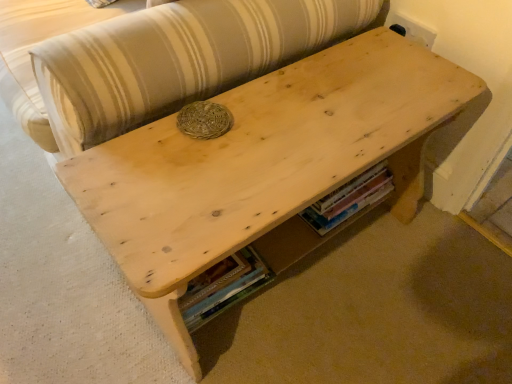
Question: Is wooden book at lower center, which is counted as the first book, starting from the right, inside the boundaries of wooden book at lower center, which appears as the 1th book when ordered from the bottom, or outside?

Choices:
 (A) outside
 (B) inside

Answer: (A)

Question: Is point (364, 173) closer or farther from the camera than point (240, 258)?

Choices:
 (A) farther
 (B) closer

Answer: (B)

Question: Estimate the real-world distances between objects in this image. Which object is farther from the natural wood couch at upper center?

Choices:
 (A) wooden book at lower center, the second book in the bottom-to-top sequence
 (B) wooden book at lower center, which appears as the 1th book when ordered from the bottom

Answer: (A)

Question: Which is nearer to the wooden book at lower center, arranged as the second book when viewed from the left?

Choices:
 (A) wooden book at lower center, arranged as the 2th book when viewed from the top
 (B) natural wood couch at upper center

Answer: (A)